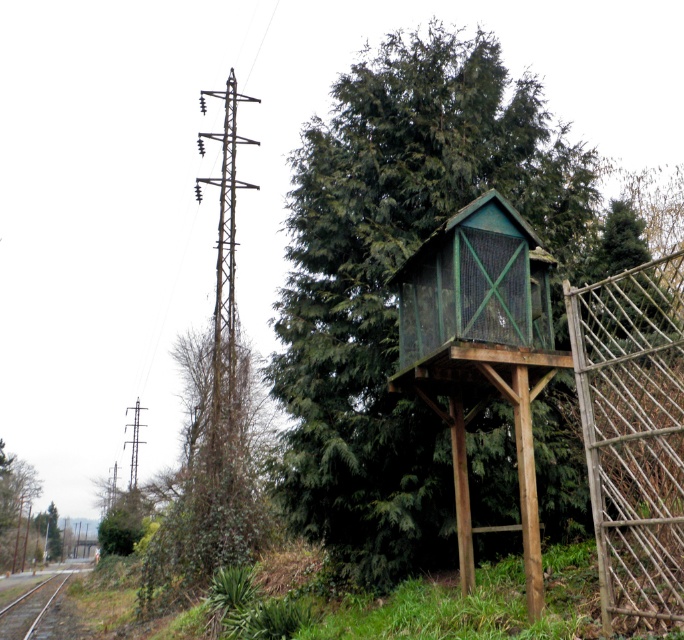
Question: Considering the relative positions of green wooden birdhouse at center and metallic wire at left in the image provided, where is green wooden birdhouse at center located with respect to metallic wire at left?

Choices:
 (A) right
 (B) left

Answer: (A)

Question: Which is nearer to the green wooden birdhouse at center?

Choices:
 (A) smooth metal train track at lower left
 (B) metallic wire at left

Answer: (B)

Question: Which of the following is the farthest from the observer?

Choices:
 (A) green wooden birdhouse at center
 (B) smooth metal train track at lower left
 (C) metallic wire at left

Answer: (B)

Question: Which of the following is the closest to the observer?

Choices:
 (A) (376, 422)
 (B) (233, 326)
 (C) (0, 580)

Answer: (A)

Question: Does green wooden birdhouse at center come in front of smooth metal train track at lower left?

Choices:
 (A) no
 (B) yes

Answer: (B)

Question: Observing the image, what is the correct spatial positioning of metallic wire at left in reference to smooth metal train track at lower left?

Choices:
 (A) right
 (B) left

Answer: (A)